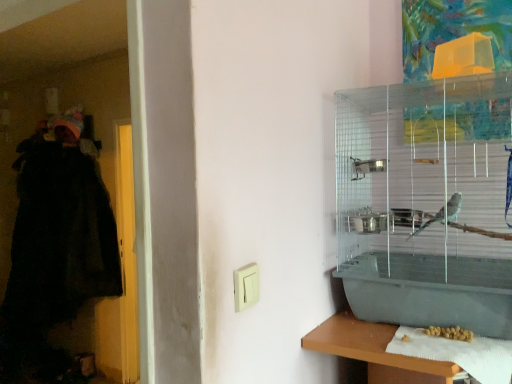
Question: Is white paper towel at lower right positioned in front of white plastic light switch at center?

Choices:
 (A) yes
 (B) no

Answer: (B)

Question: Is white plastic light switch at center inside white paper towel at lower right?

Choices:
 (A) no
 (B) yes

Answer: (A)

Question: Considering the relative sizes of white paper towel at lower right and white plastic light switch at center in the image provided, is white paper towel at lower right thinner than white plastic light switch at center?

Choices:
 (A) yes
 (B) no

Answer: (B)

Question: Is white paper towel at lower right wider than white plastic light switch at center?

Choices:
 (A) no
 (B) yes

Answer: (B)

Question: Is white paper towel at lower right next to white plastic light switch at center?

Choices:
 (A) no
 (B) yes

Answer: (A)

Question: Could you tell me if white paper towel at lower right is facing white plastic light switch at center?

Choices:
 (A) yes
 (B) no

Answer: (B)

Question: Are yellow matte seeds at lower right and white plastic light switch at center far apart?

Choices:
 (A) yes
 (B) no

Answer: (B)

Question: Is yellow matte seeds at lower right next to white plastic light switch at center and touching it?

Choices:
 (A) no
 (B) yes

Answer: (A)

Question: Is white plastic light switch at center inside yellow matte seeds at lower right?

Choices:
 (A) yes
 (B) no

Answer: (B)

Question: Is yellow matte seeds at lower right behind white plastic light switch at center?

Choices:
 (A) no
 (B) yes

Answer: (B)

Question: Is yellow matte seeds at lower right at the left side of white plastic light switch at center?

Choices:
 (A) no
 (B) yes

Answer: (A)

Question: From a real-world perspective, is yellow matte seeds at lower right on top of white plastic light switch at center?

Choices:
 (A) no
 (B) yes

Answer: (A)

Question: Is black fuzzy robe at left aimed at yellow matte seeds at lower right?

Choices:
 (A) no
 (B) yes

Answer: (A)